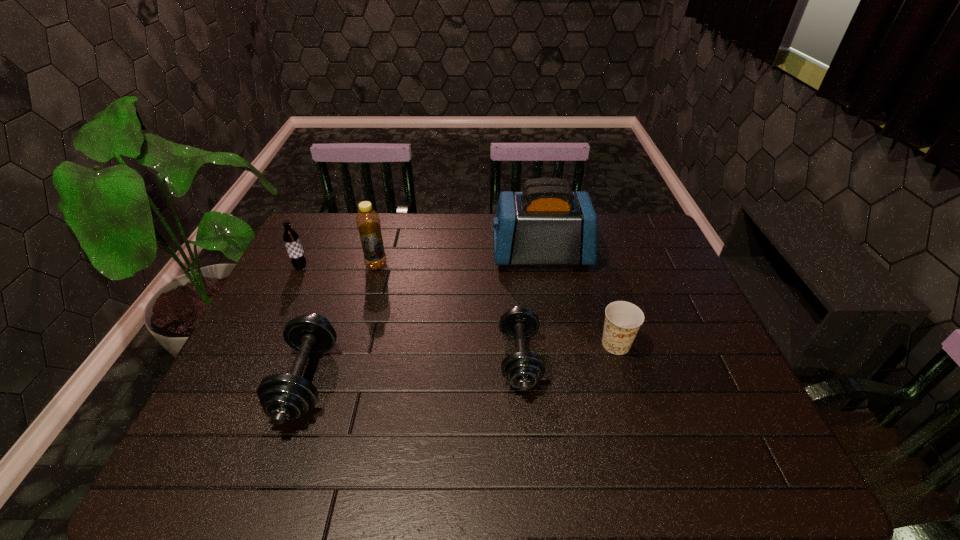
Locate an element on the screen. The image size is (960, 540). empty location between the taller dumbbell and the Dixie cup is located at coordinates (461, 362).

The height and width of the screenshot is (540, 960). What are the coordinates of `free space between the bottle and the right dumbbell` in the screenshot? It's located at (448, 312).

Locate an element on the screen. This screenshot has height=540, width=960. free space between the right dumbbell and the Dixie cup is located at coordinates (567, 352).

Where is `object that is the fourth closest to the fifth shortest object`? object that is the fourth closest to the fifth shortest object is located at coordinates (523, 370).

Select which object is the third closest to the second tallest object. Please provide its 2D coordinates. Your answer should be formatted as a tuple, i.e. [(x, y)], where the tuple contains the x and y coordinates of a point satisfying the conditions above.

[(547, 224)]

Where is `vacant space that satisfies the following two spatial constraints: 1. on the front-facing side of the toaster; 2. on the back side of the Dixie cup`? vacant space that satisfies the following two spatial constraints: 1. on the front-facing side of the toaster; 2. on the back side of the Dixie cup is located at coordinates (556, 345).

The height and width of the screenshot is (540, 960). In order to click on free space in the image that satisfies the following two spatial constraints: 1. on the front side of the leftmost object; 2. on the left side of the shorter dumbbell in this screenshot , I will do `click(255, 359)`.

The height and width of the screenshot is (540, 960). In order to click on free location that satisfies the following two spatial constraints: 1. on the front-facing side of the toaster; 2. on the front side of the leftmost object in this screenshot , I will do `click(543, 266)`.

In order to click on free space that satisfies the following two spatial constraints: 1. on the front-facing side of the Dixie cup; 2. on the left side of the toaster in this screenshot , I will do `click(556, 345)`.

Find the location of a particular element. The height and width of the screenshot is (540, 960). vacant area in the image that satisfies the following two spatial constraints: 1. on the back side of the right dumbbell; 2. on the right side of the Dixie cup is located at coordinates (518, 345).